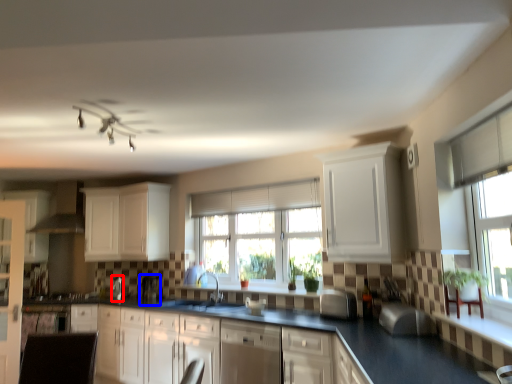
Question: Which point is closer to the camera, appliance (highlighted by a red box) or coffee machine (highlighted by a blue box)?

Choices:
 (A) appliance
 (B) coffee machine

Answer: (B)